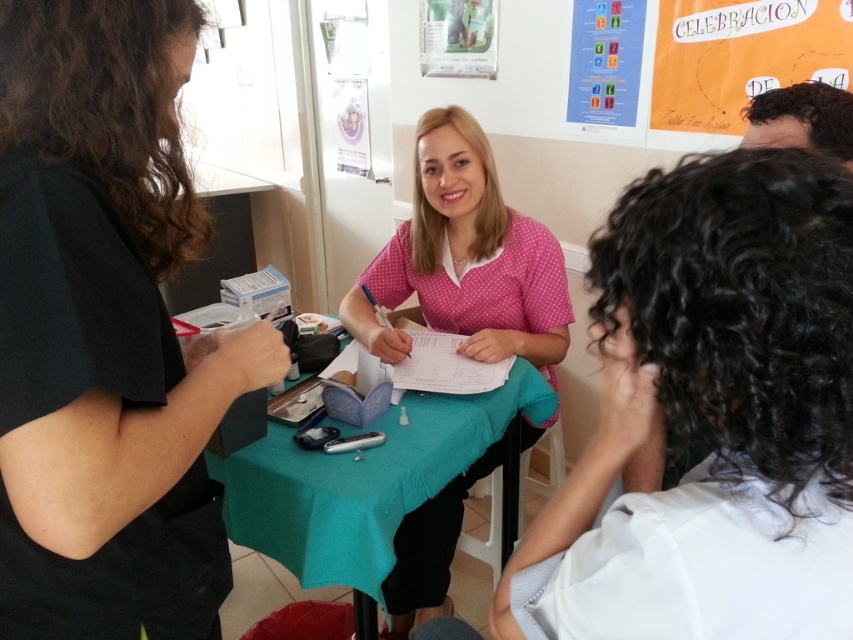
Question: Is black matte shirt at left positioned before teal fabric table at center?

Choices:
 (A) yes
 (B) no

Answer: (A)

Question: Which is farther from the pink dotted shirt at center?

Choices:
 (A) black matte shirt at left
 (B) teal fabric table at center

Answer: (A)

Question: Which point is closer to the camera?

Choices:
 (A) black matte shirt at left
 (B) teal fabric table at center

Answer: (A)

Question: Is black matte shirt at left positioned behind teal fabric table at center?

Choices:
 (A) no
 (B) yes

Answer: (A)

Question: Does pink dotted shirt at center appear under teal fabric table at center?

Choices:
 (A) yes
 (B) no

Answer: (B)

Question: Which is farther from the teal fabric table at center?

Choices:
 (A) pink dotted shirt at center
 (B) black matte shirt at left

Answer: (B)